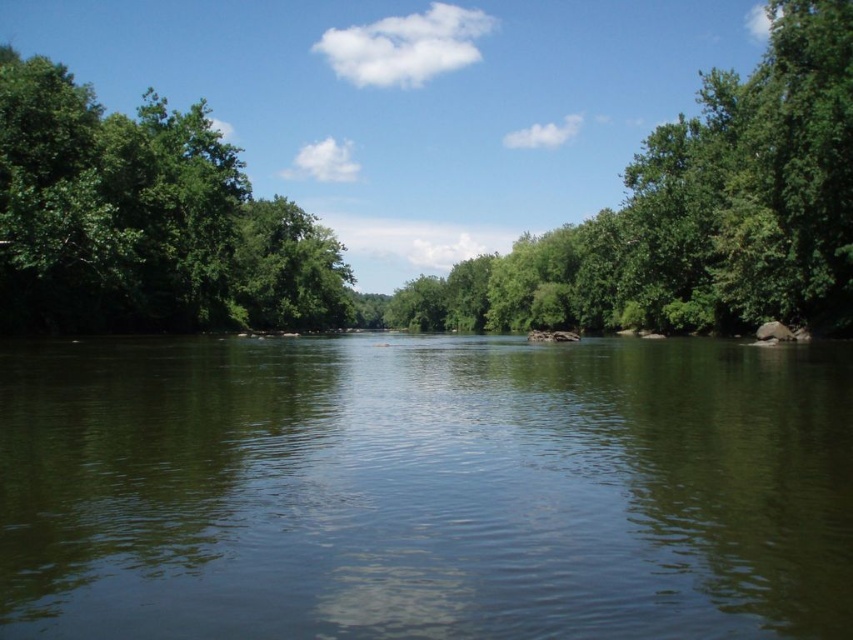
Question: Which point is closer to the camera taking this photo?

Choices:
 (A) (531, 572)
 (B) (32, 172)

Answer: (A)

Question: Can you confirm if green leafy tree at center is positioned above green leafy tree at left?

Choices:
 (A) yes
 (B) no

Answer: (B)

Question: Considering the real-world distances, which object is farthest from the green leafy tree at left?

Choices:
 (A) green leafy tree at center
 (B) green smooth water at center

Answer: (A)

Question: Does green smooth water at center appear under green leafy tree at left?

Choices:
 (A) yes
 (B) no

Answer: (A)

Question: In this image, where is green smooth water at center located relative to green leafy tree at center?

Choices:
 (A) right
 (B) left

Answer: (B)

Question: Which object is positioned closest to the green leafy tree at left?

Choices:
 (A) green leafy tree at center
 (B) green smooth water at center

Answer: (B)